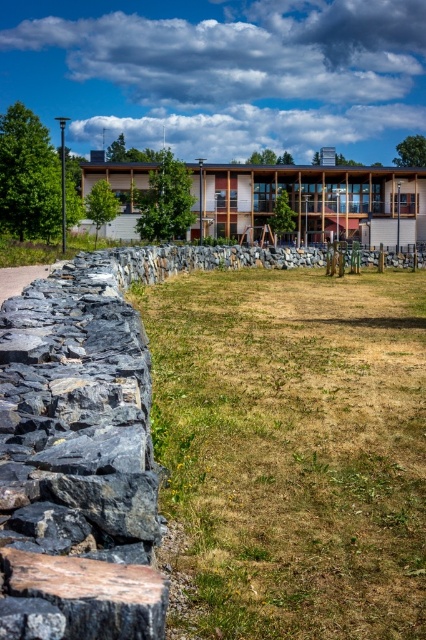
Can you confirm if dry grass at center is positioned above dark gray rough stone wall at left?

No.

Between dry grass at center and dark gray rough stone wall at left, which one appears on the right side from the viewer's perspective?

dry grass at center

Which is in front, point (267, 284) or point (129, 554)?

Point (129, 554) is in front.

Locate an element on the screen. The image size is (426, 640). dry grass at center is located at coordinates (290, 451).